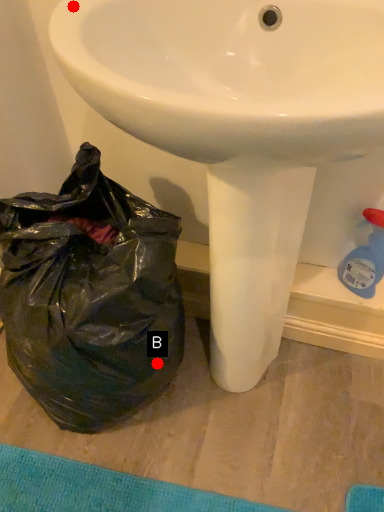
Question: Two points are circled on the image, labeled by A and B beside each circle. Which point appears closest to the camera in this image?

Choices:
 (A) A is closer
 (B) B is closer

Answer: (A)